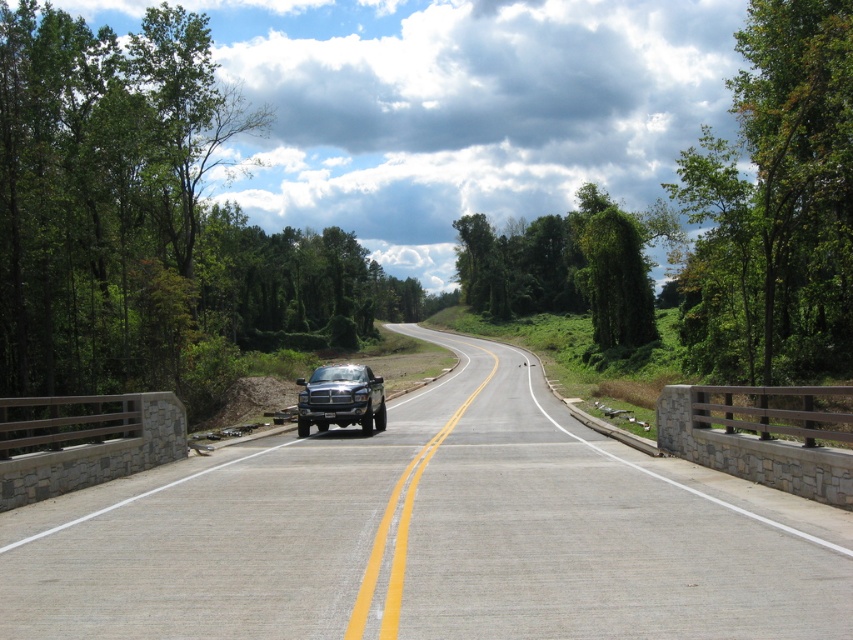
Question: Observing the image, what is the correct spatial positioning of gray asphalt highway at center in reference to matte black truck at center?

Choices:
 (A) below
 (B) above

Answer: (A)

Question: Which object is farther from the camera taking this photo?

Choices:
 (A) gray asphalt highway at center
 (B) matte black truck at center

Answer: (B)

Question: Where is gray asphalt highway at center located in relation to matte black truck at center in the image?

Choices:
 (A) below
 (B) above

Answer: (A)

Question: Does gray asphalt highway at center lie behind matte black truck at center?

Choices:
 (A) yes
 (B) no

Answer: (B)

Question: Among these objects, which one is nearest to the camera?

Choices:
 (A) matte black truck at center
 (B) gray asphalt highway at center

Answer: (B)